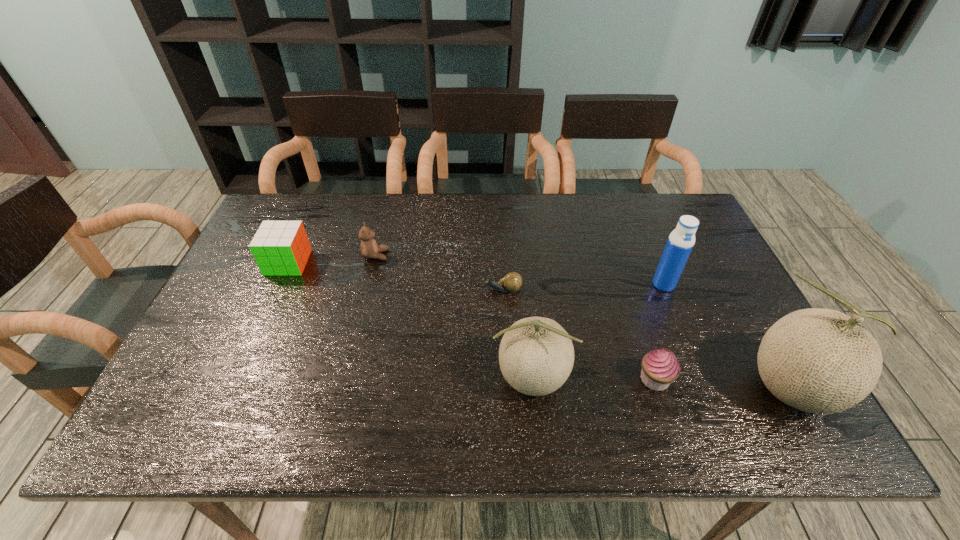
Find the location of a particular element. This screenshot has height=540, width=960. the left cantaloup is located at coordinates (536, 355).

Image resolution: width=960 pixels, height=540 pixels. I want to click on the taller cantaloup, so click(822, 361).

What are the coordinates of `the tallest object` in the screenshot? It's located at (822, 361).

Identify the location of water bottle. (680, 243).

What are the coordinates of `escargot` in the screenshot? It's located at (512, 282).

Image resolution: width=960 pixels, height=540 pixels. Find the location of `the leftmost object`. the leftmost object is located at coordinates (281, 248).

The image size is (960, 540). In order to click on teddy bear in this screenshot , I will do `click(369, 249)`.

Image resolution: width=960 pixels, height=540 pixels. Find the location of `the fifth object from left to right`. the fifth object from left to right is located at coordinates (660, 367).

I want to click on vacant space located 0.350m on the left of the left cantaloup, so click(x=340, y=379).

You are a GUI agent. You are given a task and a screenshot of the screen. Output one action in this format:
    pyautogui.click(x=<x>, y=<y>)
    Task: Click on the free spot located on the left of the water bottle
    This screenshot has height=540, width=960.
    Given the screenshot: What is the action you would take?
    click(624, 284)